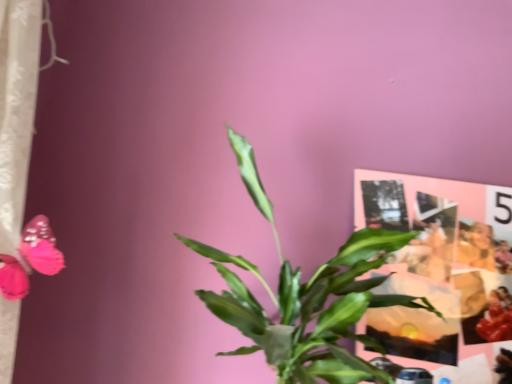
Question: Can smooth beige jacket at upper right be found inside green leafy plant at center?

Choices:
 (A) yes
 (B) no

Answer: (B)

Question: From the image's perspective, is green leafy plant at center located beneath smooth beige jacket at upper right?

Choices:
 (A) yes
 (B) no

Answer: (B)

Question: Does green leafy plant at center appear on the left side of smooth beige jacket at upper right?

Choices:
 (A) no
 (B) yes

Answer: (B)

Question: From a real-world perspective, is green leafy plant at center physically below smooth beige jacket at upper right?

Choices:
 (A) yes
 (B) no

Answer: (A)

Question: From the image's perspective, is green leafy plant at center on smooth beige jacket at upper right?

Choices:
 (A) no
 (B) yes

Answer: (B)

Question: Is green leafy plant at center to the right of smooth beige jacket at upper right from the viewer's perspective?

Choices:
 (A) yes
 (B) no

Answer: (B)

Question: From the image's perspective, is smooth beige jacket at upper right below green leafy plant at center?

Choices:
 (A) yes
 (B) no

Answer: (A)

Question: Would you say smooth beige jacket at upper right is a long distance from green leafy plant at center?

Choices:
 (A) no
 (B) yes

Answer: (A)

Question: Is smooth beige jacket at upper right facing towards green leafy plant at center?

Choices:
 (A) yes
 (B) no

Answer: (B)

Question: Considering the relative positions of smooth beige jacket at upper right and green leafy plant at center in the image provided, is smooth beige jacket at upper right behind green leafy plant at center?

Choices:
 (A) no
 (B) yes

Answer: (B)

Question: From a real-world perspective, is smooth beige jacket at upper right located higher than green leafy plant at center?

Choices:
 (A) yes
 (B) no

Answer: (A)

Question: Is smooth beige jacket at upper right touching green leafy plant at center?

Choices:
 (A) yes
 (B) no

Answer: (B)

Question: Does smooth beige jacket at upper right have a smaller size compared to matte paper collage at upper right?

Choices:
 (A) no
 (B) yes

Answer: (B)